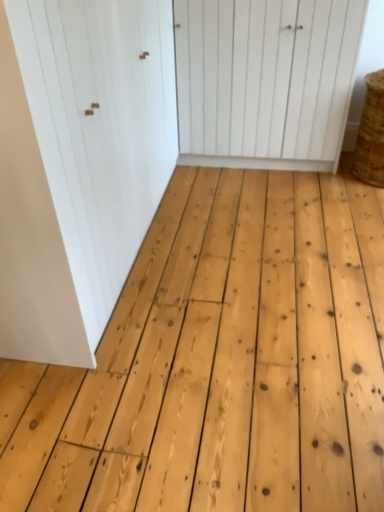
The height and width of the screenshot is (512, 384). Find the location of `white matte door at upper left, arranged as the 2th door when viewed from the right`. white matte door at upper left, arranged as the 2th door when viewed from the right is located at coordinates [x=79, y=164].

At what (x,y) coordinates should I click in order to perform the action: click on braided straw basket at right. Please return your answer as a coordinate pair (x, y). Looking at the image, I should click on (371, 133).

What is the approximate width of white wood door at center, which is counted as the second door, starting from the left?

The width of white wood door at center, which is counted as the second door, starting from the left, is 16.12 inches.

At what (x,y) coordinates should I click in order to perform the action: click on white matte door at upper left, arranged as the 2th door when viewed from the right. Please return your answer as a coordinate pair (x, y). Looking at the image, I should click on (79, 164).

Can you confirm if white matte door at upper left, the 1th door in the left-to-right sequence, is bigger than braided straw basket at right?

Yes, white matte door at upper left, the 1th door in the left-to-right sequence, is bigger than braided straw basket at right.

Who is taller, white matte door at upper left, arranged as the 2th door when viewed from the right, or braided straw basket at right?

Standing taller between the two is white matte door at upper left, arranged as the 2th door when viewed from the right.

Is white matte door at upper left, the 1th door in the left-to-right sequence, oriented away from braided straw basket at right?

white matte door at upper left, the 1th door in the left-to-right sequence, is not turned away from braided straw basket at right.

Image resolution: width=384 pixels, height=512 pixels. I want to click on basket on the right of the white matte door at upper left, arranged as the 2th door when viewed from the right, so click(371, 133).

Is point (379, 121) behind point (103, 10)?

Yes, point (379, 121) is behind point (103, 10).

Is white matte door at upper left, the 1th door in the left-to-right sequence, positioned far away from white wood door at center, which is the first door from right to left?

Yes, white matte door at upper left, the 1th door in the left-to-right sequence, and white wood door at center, which is the first door from right to left, are quite far apart.

From a real-world perspective, is white matte door at upper left, arranged as the 2th door when viewed from the right, over white wood door at center, which is counted as the second door, starting from the left?

Yes, from a real-world perspective, white matte door at upper left, arranged as the 2th door when viewed from the right, is on top of white wood door at center, which is counted as the second door, starting from the left.

Is white wood door at center, which is counted as the second door, starting from the left, located within white matte door at upper left, arranged as the 2th door when viewed from the right?

No, white wood door at center, which is counted as the second door, starting from the left, is located outside of white matte door at upper left, arranged as the 2th door when viewed from the right.

Is point (156, 50) closer to camera compared to point (191, 37)?

Yes, it is in front of point (191, 37).

In the scene shown: Can you tell me how much white wood door at center, which is the first door from right to left, and braided straw basket at right differ in facing direction?

There is a 0.000415-degree angle between the facing directions of white wood door at center, which is the first door from right to left, and braided straw basket at right.

From a real-world perspective, relative to braided straw basket at right, is white wood door at center, which is the first door from right to left, vertically above or below?

From a real-world perspective, white wood door at center, which is the first door from right to left, is physically above braided straw basket at right.

Could you measure the distance between white wood door at center, which is the first door from right to left, and braided straw basket at right?

They are 28.04 inches apart.

Locate an element on the screen. This screenshot has width=384, height=512. basket below the white wood door at center, which is the first door from right to left (from the image's perspective) is located at coordinates (371, 133).

Considering the sizes of objects braided straw basket at right and white wood door at center, which is the first door from right to left, in the image provided, who is thinner, braided straw basket at right or white wood door at center, which is the first door from right to left,?

With smaller width is white wood door at center, which is the first door from right to left.

How far apart are braided straw basket at right and white wood door at center, which is the first door from right to left?

braided straw basket at right is 28.04 inches away from white wood door at center, which is the first door from right to left.

From their relative heights in the image, would you say braided straw basket at right is taller or shorter than white wood door at center, which is the first door from right to left?

braided straw basket at right is shorter than white wood door at center, which is the first door from right to left.

From a real-world perspective, which object rests below the other?

In real-world perspective, braided straw basket at right is lower.

Are white wood door at center, which is the first door from right to left, and white matte door at upper left, the 1th door in the left-to-right sequence, far apart?

Yes.

Considering the sizes of objects white wood door at center, which is the first door from right to left, and white matte door at upper left, the 1th door in the left-to-right sequence, in the image provided, who is thinner, white wood door at center, which is the first door from right to left, or white matte door at upper left, the 1th door in the left-to-right sequence,?

white wood door at center, which is the first door from right to left, is thinner.

Who is taller, white wood door at center, which is counted as the second door, starting from the left, or white matte door at upper left, the 1th door in the left-to-right sequence?

white matte door at upper left, the 1th door in the left-to-right sequence, is taller.

Is white wood door at center, which is counted as the second door, starting from the left, looking in the opposite direction of white matte door at upper left, the 1th door in the left-to-right sequence?

No.

The width and height of the screenshot is (384, 512). In order to click on basket located above the white matte door at upper left, arranged as the 2th door when viewed from the right (from the image's perspective) in this screenshot , I will do `click(371, 133)`.

This screenshot has height=512, width=384. What are the coordinates of `the 2nd door located above the braided straw basket at right (from a real-world perspective)` in the screenshot? It's located at (79, 164).

When comparing their distances from braided straw basket at right, does white wood door at center, which is the first door from right to left, or white matte door at upper left, the 1th door in the left-to-right sequence, seem further?

Among the two, white matte door at upper left, the 1th door in the left-to-right sequence, is located further to braided straw basket at right.

When comparing their distances from white wood door at center, which is counted as the second door, starting from the left, does braided straw basket at right or white matte door at upper left, arranged as the 2th door when viewed from the right, seem closer?

Based on the image, braided straw basket at right appears to be nearer to white wood door at center, which is counted as the second door, starting from the left.

When comparing their distances from braided straw basket at right, does white matte door at upper left, arranged as the 2th door when viewed from the right, or white wood door at center, which is the first door from right to left, seem further?

white matte door at upper left, arranged as the 2th door when viewed from the right, is further to braided straw basket at right.

Which object lies further to the anchor point white wood door at center, which is counted as the second door, starting from the left, white matte door at upper left, the 1th door in the left-to-right sequence, or braided straw basket at right?

white matte door at upper left, the 1th door in the left-to-right sequence, is further to white wood door at center, which is counted as the second door, starting from the left.

Estimate the real-world distances between objects in this image. Which object is further from white matte door at upper left, the 1th door in the left-to-right sequence, white wood door at center, which is counted as the second door, starting from the left, or braided straw basket at right?

braided straw basket at right.

From the image, which object appears to be farther from white matte door at upper left, the 1th door in the left-to-right sequence, braided straw basket at right or white wood door at center, which is counted as the second door, starting from the left?

braided straw basket at right is positioned further to the anchor white matte door at upper left, the 1th door in the left-to-right sequence.

You are a GUI agent. You are given a task and a screenshot of the screen. Output one action in this format:
    pyautogui.click(x=<x>, y=<y>)
    Task: Click on the door situated between white matte door at upper left, the 1th door in the left-to-right sequence, and braided straw basket at right from left to right
    Image resolution: width=384 pixels, height=512 pixels.
    Given the screenshot: What is the action you would take?
    pyautogui.click(x=265, y=80)